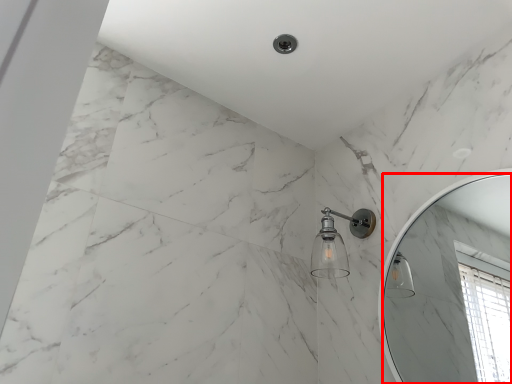
Question: Considering the relative positions of mirror (annotated by the red box) and shower in the image provided, where is mirror (annotated by the red box) located with respect to the staircase?

Choices:
 (A) left
 (B) right

Answer: (B)